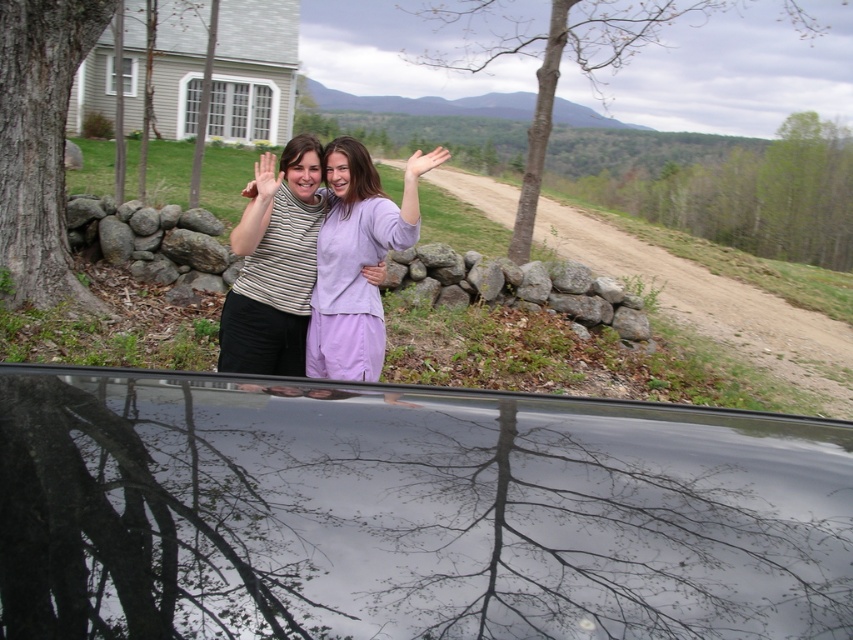
You are standing in front of the house and looking at the image. Where is the glossy black car window at center located in the scene?

The glossy black car window at center is located at point coordinates 0.803 on the x axis and 0.481 on the y axis.

You are a photographer trying to capture a group photo of two friends. You notice their matte black hand at upper center and matte purple hand at upper center are currently 1.65 meters apart. To ensure both hands are visible in the frame without overlapping, what minimum distance should you maintain from them?

The minimum distance should be at least 1.65 meters to ensure both the matte black hand at upper center and matte purple hand at upper center are visible without overlapping.

You are a photographer trying to capture the two hands in the image. Which hand, the matte black hand at upper center or the matte purple hand at upper center, is located to the left of the other?

The matte black hand at upper center is positioned on the left side of the matte purple hand at upper center.